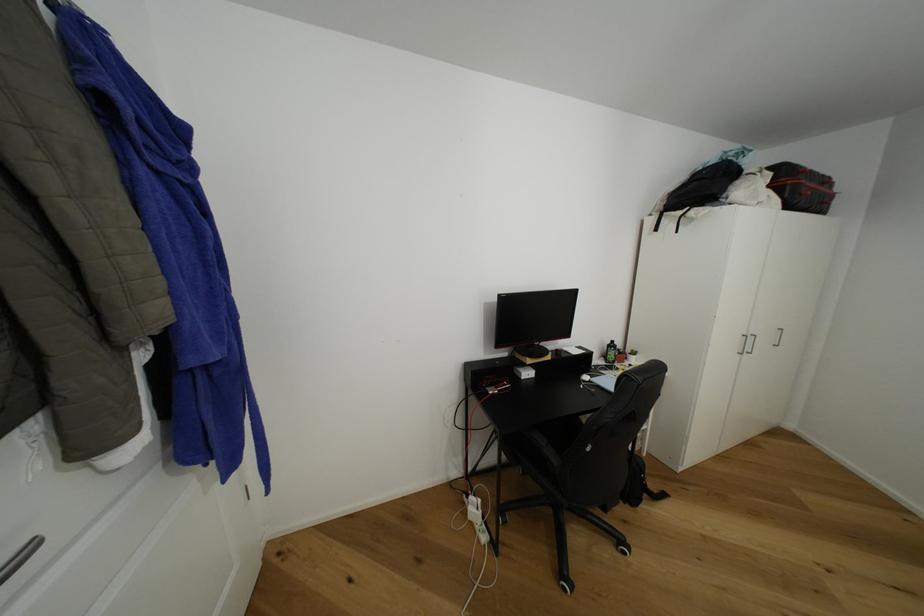
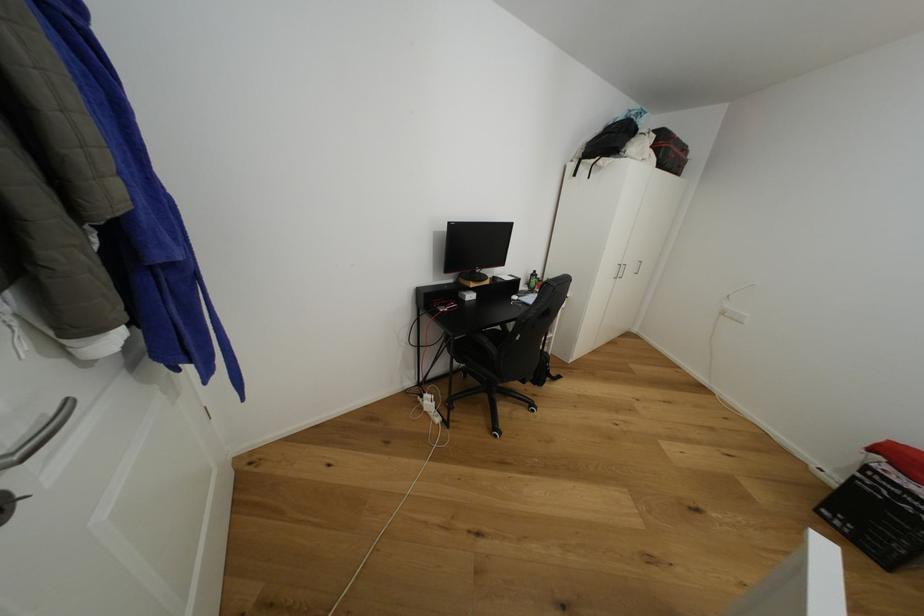
The point at (549, 446) is marked in the first image. Where is the corresponding point in the second image?

(491, 342)